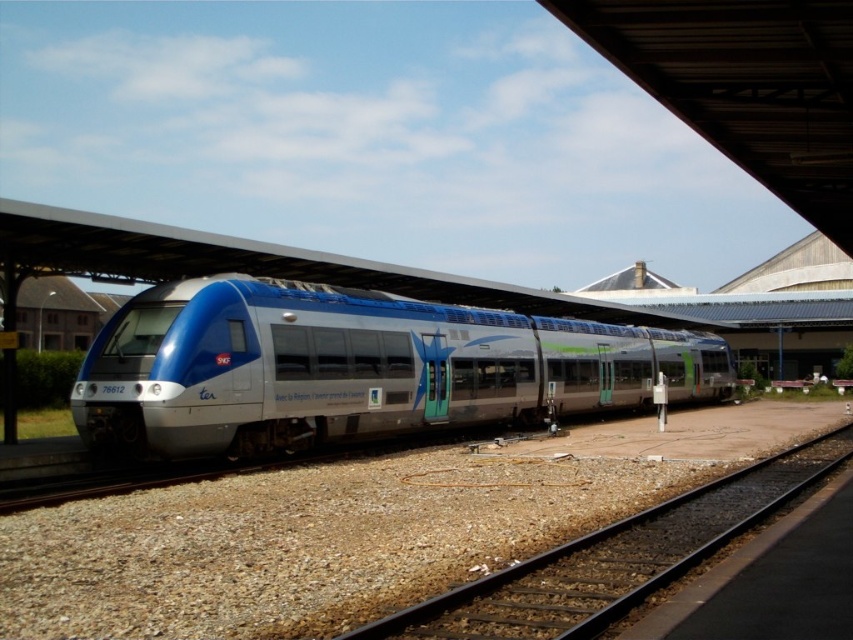
Question: Which point is closer to the camera taking this photo?

Choices:
 (A) (143, 372)
 (B) (720, 515)

Answer: (B)

Question: Is matte metallic train at center in front of black metal train track at lower center?

Choices:
 (A) no
 (B) yes

Answer: (A)

Question: Observing the image, what is the correct spatial positioning of matte metallic train at center in reference to black metal train track at lower center?

Choices:
 (A) right
 (B) left

Answer: (A)

Question: Is matte metallic train at center above black metal train track at lower center?

Choices:
 (A) yes
 (B) no

Answer: (A)